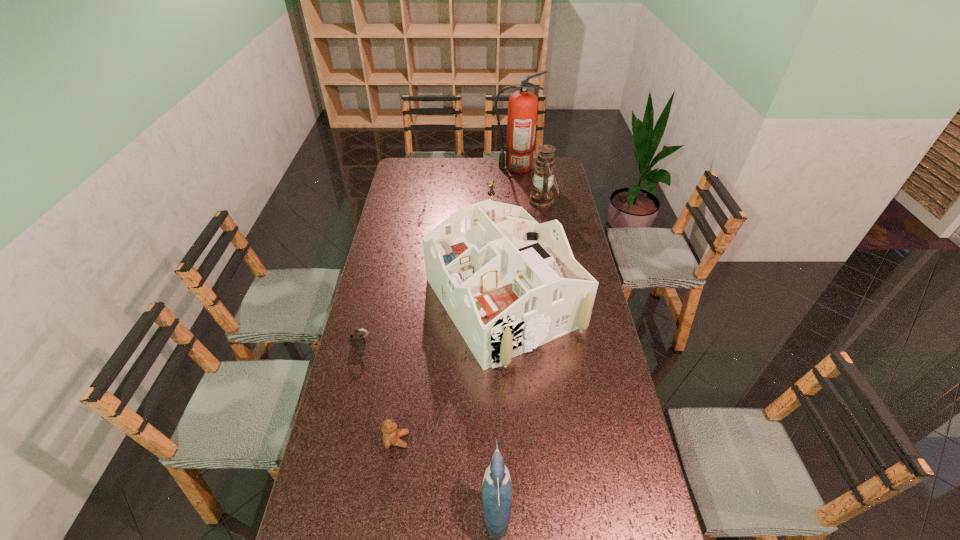
You are a GUI agent. You are given a task and a screenshot of the screen. Output one action in this format:
    pyautogui.click(x=<x>, y=<y>)
    Task: Click on the object that stands as the sixth closest to the sixth farthest object
    The image size is (960, 540).
    Given the screenshot: What is the action you would take?
    pyautogui.click(x=522, y=106)

Identify the location of object that is the second closest to the padlock. (391, 435).